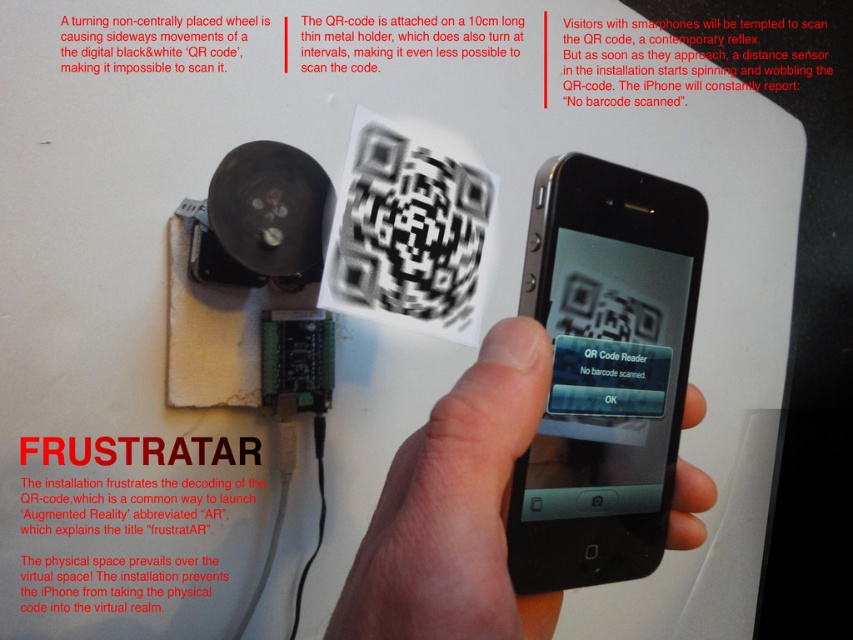
Question: Does black matte smartphone at center come behind skinsmoothhand at center?

Choices:
 (A) no
 (B) yes

Answer: (B)

Question: Does black matte smartphone at center have a larger size compared to skinsmoothhand at center?

Choices:
 (A) no
 (B) yes

Answer: (A)

Question: Which point appears farthest from the camera in this image?

Choices:
 (A) (543, 406)
 (B) (572, 230)

Answer: (B)

Question: Which object is closer to the camera taking this photo?

Choices:
 (A) skinsmoothhand at center
 (B) black matte smartphone at center

Answer: (A)

Question: Is black matte smartphone at center further to camera compared to skinsmoothhand at center?

Choices:
 (A) no
 (B) yes

Answer: (B)